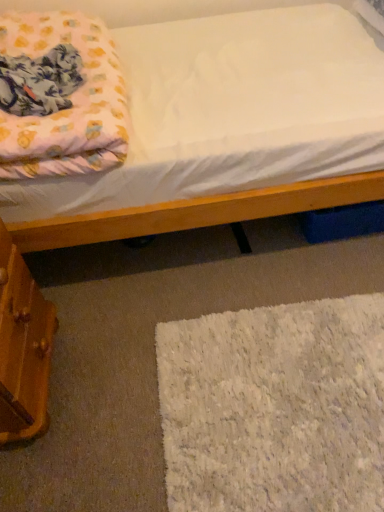
Question: From a real-world perspective, is fluffy pink blanket at upper left positioned above or below white fluffy rug at lower right?

Choices:
 (A) above
 (B) below

Answer: (A)

Question: From their relative heights in the image, would you say fluffy pink blanket at upper left is taller or shorter than white fluffy rug at lower right?

Choices:
 (A) tall
 (B) short

Answer: (A)

Question: Which object is the closest to the white fluffy rug at lower right?

Choices:
 (A) fluffy pink blanket at upper left
 (B) wooden drawer at lower left

Answer: (B)

Question: Estimate the real-world distances between objects in this image. Which object is farther from the fluffy pink blanket at upper left?

Choices:
 (A) wooden drawer at lower left
 (B) white fluffy rug at lower right

Answer: (B)